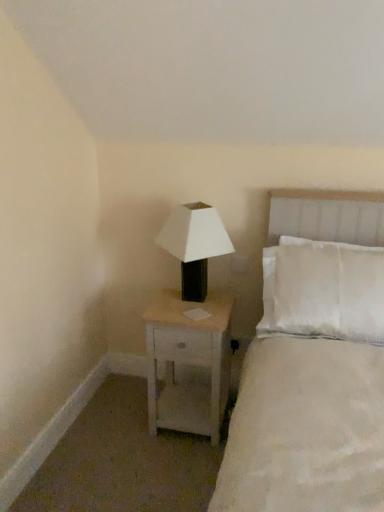
Question: From their relative heights in the image, would you say white wood nightstand at center is taller or shorter than white matte/black plastic lamp at upper right?

Choices:
 (A) short
 (B) tall

Answer: (B)

Question: Is white wood nightstand at center wider or thinner than white matte/black plastic lamp at upper right?

Choices:
 (A) thin
 (B) wide

Answer: (B)

Question: Considering the real-world distances, which object is farthest from the white soft bed at upper right?

Choices:
 (A) white wood nightstand at center
 (B) white matte/black plastic lamp at upper right

Answer: (B)

Question: Considering the real-world distances, which object is farthest from the white wood nightstand at center?

Choices:
 (A) white soft bed at upper right
 (B) white matte/black plastic lamp at upper right

Answer: (A)